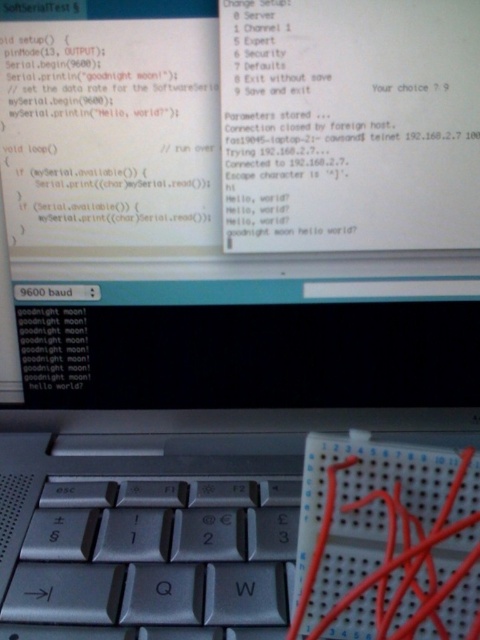
Who is taller, silver metallic keyboard at center or red plastic wire at center?

red plastic wire at center is taller.

The height and width of the screenshot is (640, 480). What do you see at coordinates (145, 550) in the screenshot? I see `silver metallic keyboard at center` at bounding box center [145, 550].

Measure the distance between point (62, 486) and camera.

The distance of point (62, 486) from camera is 19.66 inches.

Where is `silver metallic keyboard at center`? silver metallic keyboard at center is located at coordinates (145, 550).